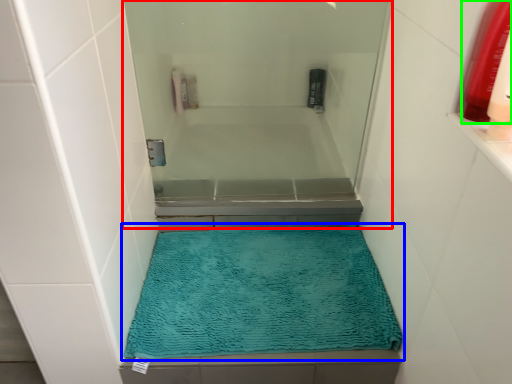
Question: Based on their relative distances, which object is farther from screen door (highlighted by a red box)? Choose from bath mat (highlighted by a blue box) and mouthwash (highlighted by a green box).

Choices:
 (A) bath mat
 (B) mouthwash

Answer: (B)